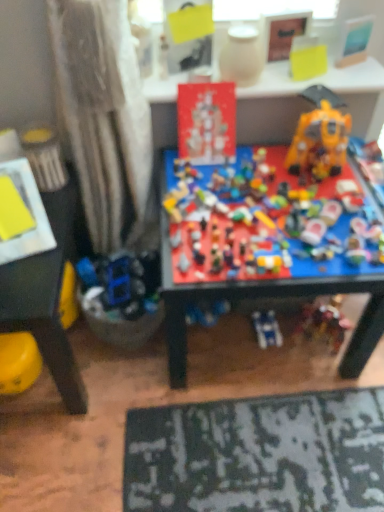
This screenshot has width=384, height=512. Identify the location of free point in front of yellow matte paper at upper center, placed as the second toy when sorted from right to left. (315, 83).